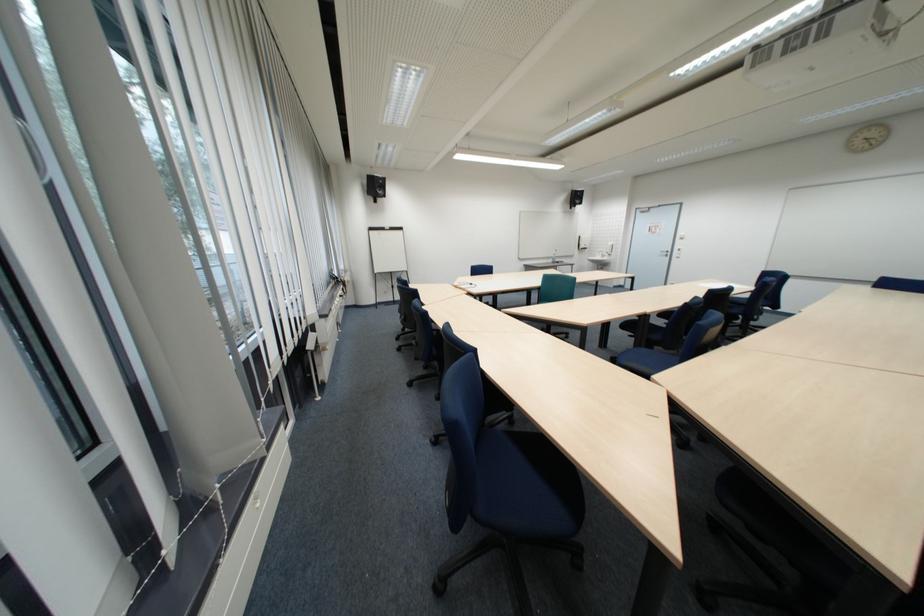
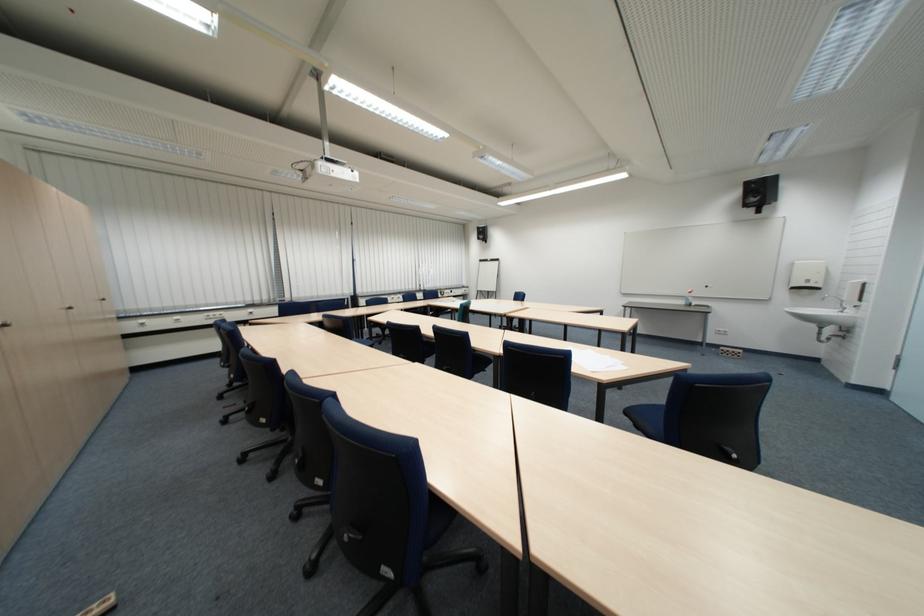
Where in the second image is the point corresponding to pixel 623 252 from the first image?

(860, 296)